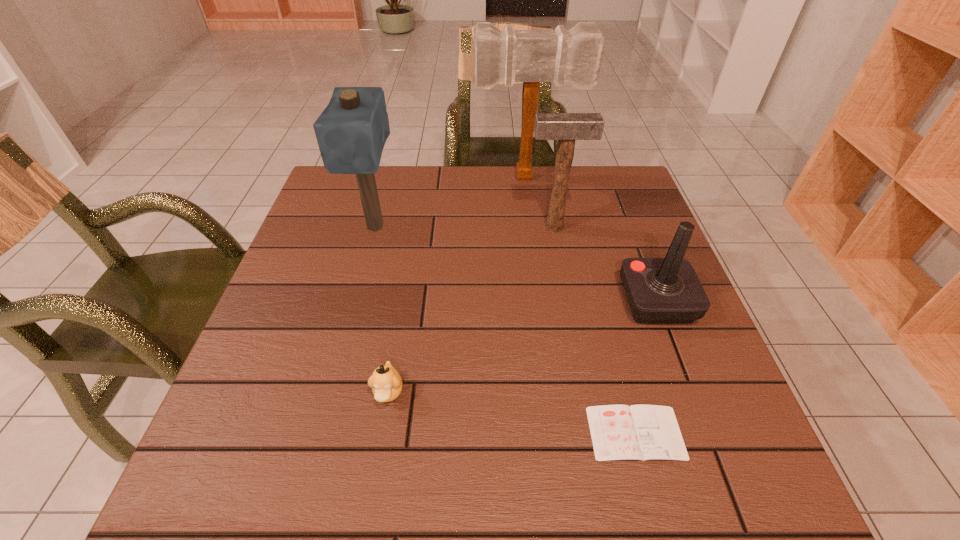
Find the location of a particular element. The height and width of the screenshot is (540, 960). vacant area between the joystick and the farthest mallet is located at coordinates (591, 239).

I want to click on vacant space in between the shortest mallet and the leftmost mallet, so click(x=465, y=227).

The height and width of the screenshot is (540, 960). Find the location of `vacant area that lies between the fifth object from right to left and the diary`. vacant area that lies between the fifth object from right to left and the diary is located at coordinates (512, 413).

Find the location of a particular element. vacant space in between the second object from left to right and the farthest object is located at coordinates (457, 285).

I want to click on free space between the third tallest object and the farthest mallet, so click(540, 202).

Where is `blank region between the farthest mallet and the shortest object`? This screenshot has height=540, width=960. blank region between the farthest mallet and the shortest object is located at coordinates (581, 305).

Locate an element on the screen. Image resolution: width=960 pixels, height=540 pixels. the closest object to the second tallest object is located at coordinates (530, 56).

This screenshot has width=960, height=540. Identify the location of the fifth closest object to the joystick. (351, 132).

Where is `mallet that is the second nearest to the diary`? This screenshot has height=540, width=960. mallet that is the second nearest to the diary is located at coordinates (351, 132).

This screenshot has width=960, height=540. What are the coordinates of `the closest mallet to the diary` in the screenshot? It's located at (565, 127).